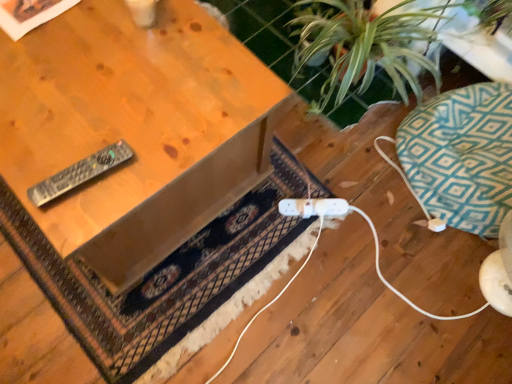
Locate an element on the screen. The width and height of the screenshot is (512, 384). blank space to the left of black plastic remote at left is located at coordinates (32, 148).